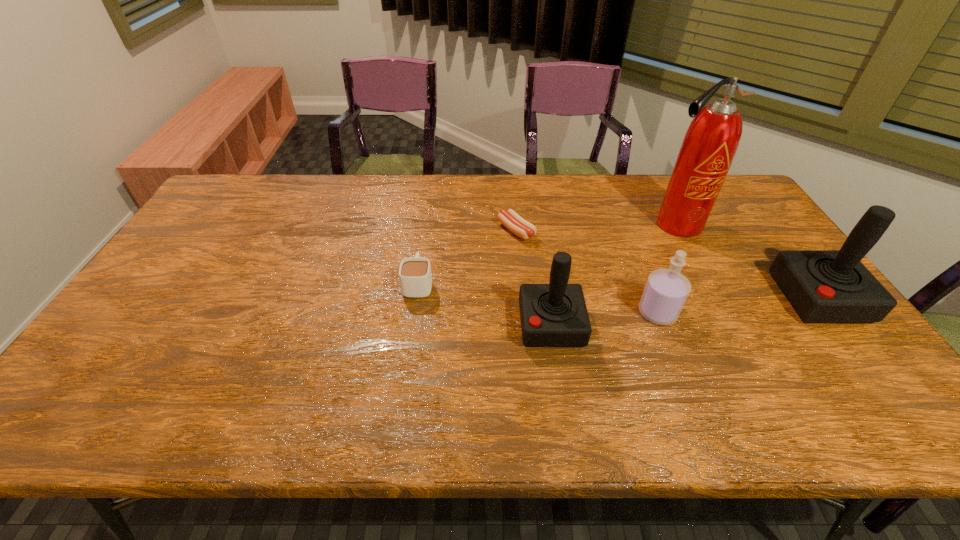
Find the location of a particular element. The width and height of the screenshot is (960, 540). free space between the left joystick and the second shortest object is located at coordinates (485, 304).

Where is `unoccupied area between the leftmost object and the taller joystick`? The width and height of the screenshot is (960, 540). unoccupied area between the leftmost object and the taller joystick is located at coordinates (618, 291).

The image size is (960, 540). In order to click on vacant space in between the rightmost object and the shortest object in this screenshot , I will do `click(667, 264)`.

Where is `free space between the perfume and the rightmost object`? The height and width of the screenshot is (540, 960). free space between the perfume and the rightmost object is located at coordinates (738, 305).

Where is `vacant area between the perfume and the shortest object`? Image resolution: width=960 pixels, height=540 pixels. vacant area between the perfume and the shortest object is located at coordinates (587, 272).

Identify the location of free area in between the perfume and the rightmost object. (738, 305).

Identify the location of vacant area that lies between the fourth object from left to right and the rightmost object. Image resolution: width=960 pixels, height=540 pixels. (738, 305).

The image size is (960, 540). In order to click on object that is the fourth nearest to the cup in this screenshot , I will do `click(711, 141)`.

Find the location of a particular element. the third closest object to the perfume is located at coordinates click(x=823, y=286).

Find the location of a particular element. Image resolution: width=960 pixels, height=540 pixels. free point that satisfies the following two spatial constraints: 1. on the side with the handle of the leftmost object; 2. on the right side of the sausage is located at coordinates (425, 231).